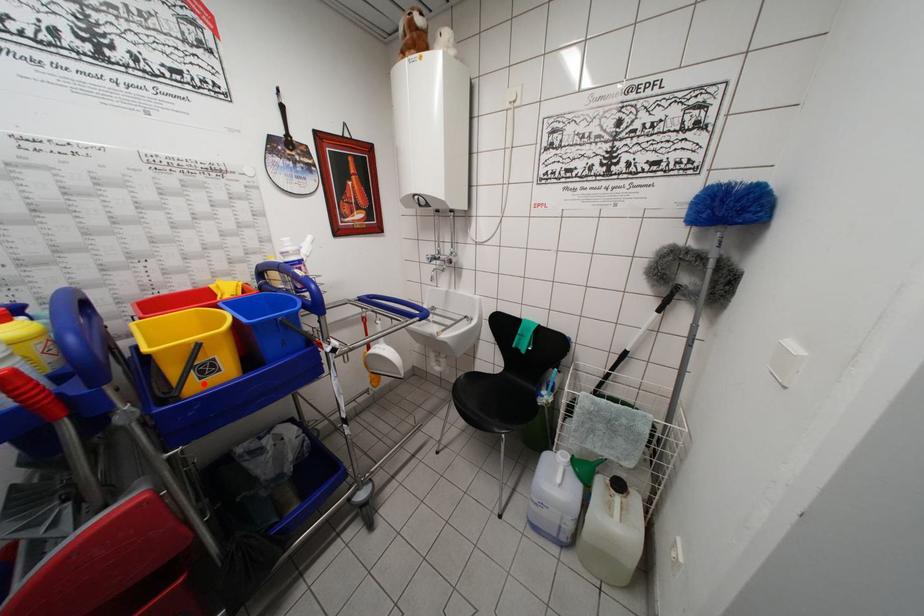
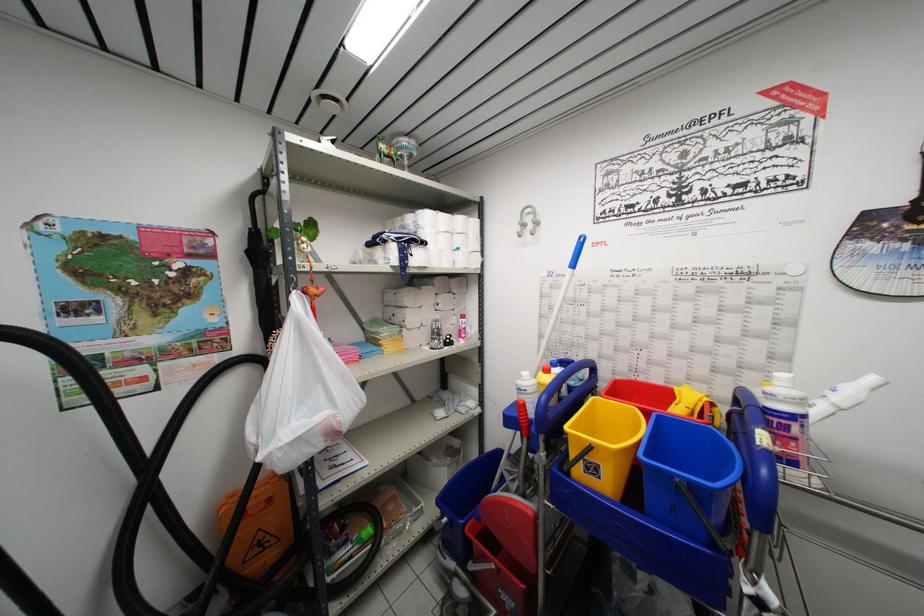
Question: I am providing you with two images of the same scene from different viewpoints. Image1 has a red point marked. In image2, the corresponding 3D location appears at what relative position? Reply with the corresponding letter.

Choices:
 (A) Closer
 (B) Farther

Answer: (A)